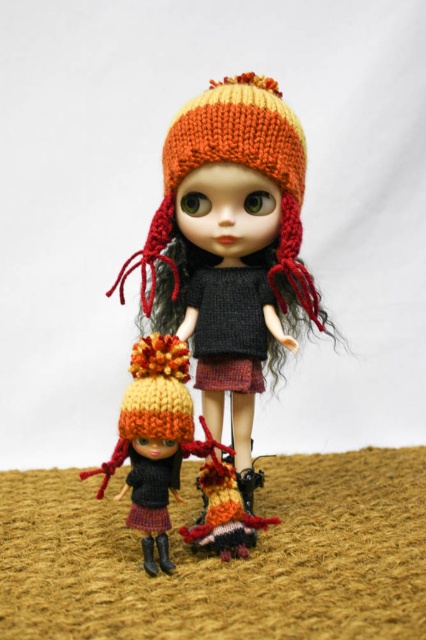
You are arranging a display with two dolls on a straw surface. You need to place a decorative item between the knitted woolen hat at center and the knitted woolen dress at lower center. Based on their positions, which side of the dress should you place the item to ensure it is between them?

The knitted woolen hat at center is on the right side of the knitted woolen dress at lower center. To place the decorative item between them, put it to the right of the dress so it is between the hat and the dress.

You are a collector trying to arrange these dolls properly. You need to place the knitted woolen hat at center and the knitted woolen dress at lower center in a line. Which one should be placed closer to the entrance of the display case so visitors can see the one further away better?

The knitted woolen dress at lower center should be placed closer to the entrance because the knitted woolen hat at center is further to the viewer. By positioning the dress nearer to the entrance, visitors will naturally perceive the hat as being in the background, enhancing the depth perception of the display.